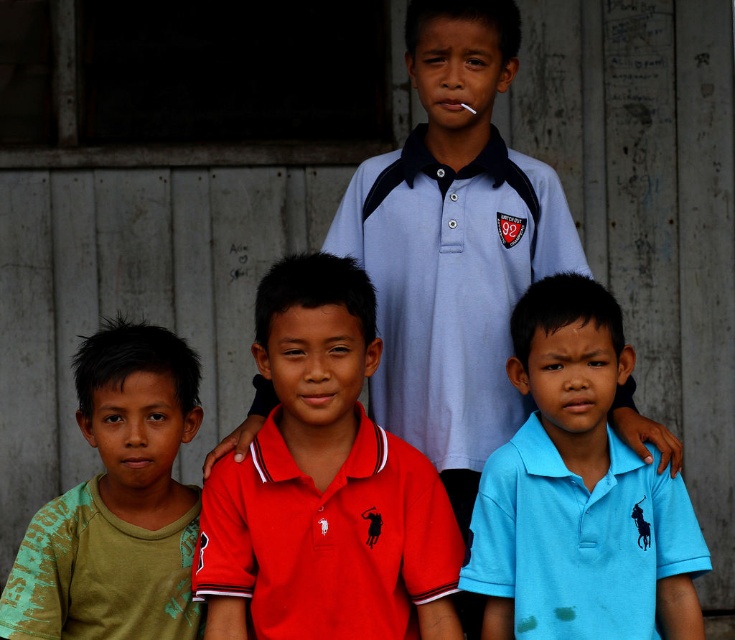
Does red matte polo shirt at center come in front of blue cotton shirt at center?

Yes, red matte polo shirt at center is in front of blue cotton shirt at center.

Between point (406, 552) and point (548, 420), which one is positioned in front?

Point (406, 552)

You are a GUI agent. You are given a task and a screenshot of the screen. Output one action in this format:
    pyautogui.click(x=<x>, y=<y>)
    Task: Click on the red matte polo shirt at center
    
    Given the screenshot: What is the action you would take?
    pyautogui.click(x=323, y=483)

Between red matte polo shirt at center and green cotton shirt at lower left, which one appears on the right side from the viewer's perspective?

From the viewer's perspective, red matte polo shirt at center appears more on the right side.

Does red matte polo shirt at center appear on the left side of green cotton shirt at lower left?

In fact, red matte polo shirt at center is to the right of green cotton shirt at lower left.

Locate an element on the screen. The height and width of the screenshot is (640, 735). red matte polo shirt at center is located at coordinates (323, 483).

Who is shorter, blue cotton shirt at center or green cotton shirt at lower left?

Standing shorter between the two is green cotton shirt at lower left.

Who is positioned more to the right, blue cotton shirt at center or green cotton shirt at lower left?

blue cotton shirt at center

Is point (556, 342) less distant than point (68, 541)?

That is True.

Where is `blue cotton shirt at center`? blue cotton shirt at center is located at coordinates (578, 492).